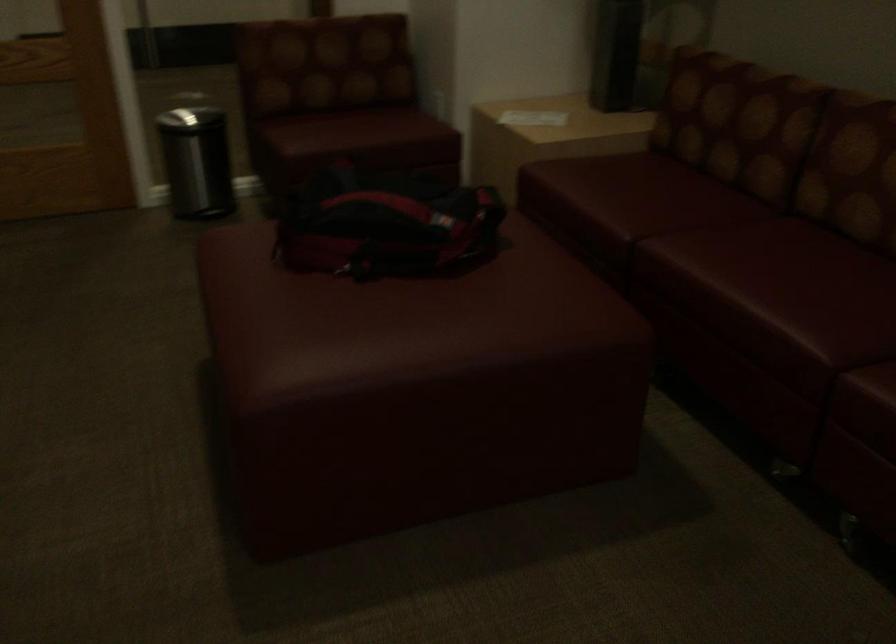
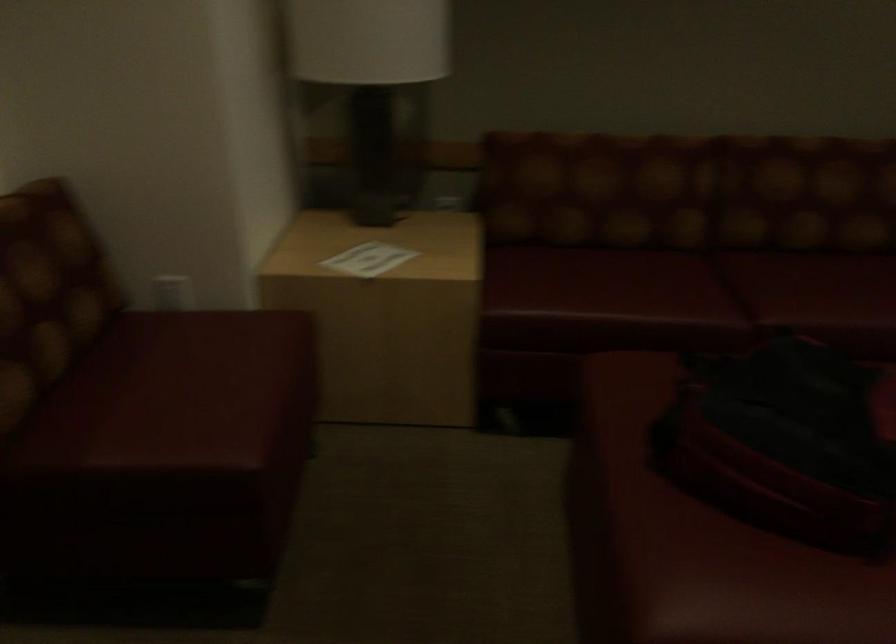
Locate, in the second image, the point that corresponds to point (529, 113) in the first image.

(367, 259)